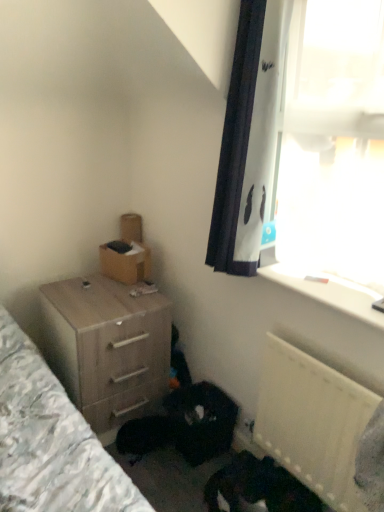
Question: Is white plastic radiator at lower right positioned far away from brown cardboard box at upper left?

Choices:
 (A) no
 (B) yes

Answer: (A)

Question: Can you confirm if white plastic radiator at lower right is positioned to the right of brown cardboard box at upper left?

Choices:
 (A) no
 (B) yes

Answer: (B)

Question: Is white plastic radiator at lower right wider than brown cardboard box at upper left?

Choices:
 (A) yes
 (B) no

Answer: (B)

Question: From the image's perspective, would you say white plastic radiator at lower right is shown under brown cardboard box at upper left?

Choices:
 (A) no
 (B) yes

Answer: (B)

Question: Is white plastic radiator at lower right not inside brown cardboard box at upper left?

Choices:
 (A) yes
 (B) no

Answer: (A)

Question: Based on their sizes in the image, would you say brown cardboard box at upper left is bigger or smaller than white plastic radiator at lower right?

Choices:
 (A) big
 (B) small

Answer: (B)

Question: Does point (132, 252) appear closer or farther from the camera than point (352, 403)?

Choices:
 (A) closer
 (B) farther

Answer: (B)

Question: Visually, is brown cardboard box at upper left positioned to the left or to the right of white plastic radiator at lower right?

Choices:
 (A) right
 (B) left

Answer: (B)

Question: Is brown cardboard box at upper left wider or thinner than white plastic radiator at lower right?

Choices:
 (A) thin
 (B) wide

Answer: (B)

Question: In terms of size, does wooden chest of drawers at lower left appear bigger or smaller than white plastic radiator at lower right?

Choices:
 (A) small
 (B) big

Answer: (B)

Question: Is wooden chest of drawers at lower left spatially inside white plastic radiator at lower right, or outside of it?

Choices:
 (A) inside
 (B) outside

Answer: (B)

Question: From the image's perspective, is wooden chest of drawers at lower left positioned above or below white plastic radiator at lower right?

Choices:
 (A) below
 (B) above

Answer: (B)

Question: In the image, is wooden chest of drawers at lower left on the left side or the right side of white plastic radiator at lower right?

Choices:
 (A) left
 (B) right

Answer: (A)

Question: From a real-world perspective, is wooden chest of drawers at lower left above or below white plastic window sill at upper right?

Choices:
 (A) above
 (B) below

Answer: (B)

Question: From the image's perspective, is wooden chest of drawers at lower left located above or below white plastic window sill at upper right?

Choices:
 (A) below
 (B) above

Answer: (A)